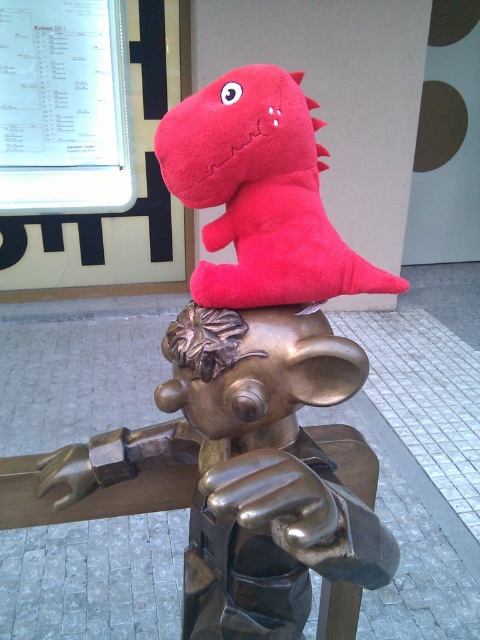
Does bronze statue at center have a larger size compared to metallic gold head at center?

Correct, bronze statue at center is larger in size than metallic gold head at center.

Looking at this image, can you confirm if bronze statue at center is thinner than metallic gold head at center?

No, bronze statue at center is not thinner than metallic gold head at center.

Describe the element at coordinates (251, 472) in the screenshot. I see `bronze statue at center` at that location.

Locate an element on the screen. bronze statue at center is located at coordinates (251, 472).

Does bronze statue at center appear over matte plush dinosaur at upper center?

No, bronze statue at center is not above matte plush dinosaur at upper center.

Which is in front, point (49, 481) or point (236, 122)?

Point (236, 122)

Locate an element on the screen. bronze statue at center is located at coordinates (251, 472).

Is matte plush dinosaur at upper center to the left of metallic gold head at center from the viewer's perspective?

Incorrect, matte plush dinosaur at upper center is not on the left side of metallic gold head at center.

Does matte plush dinosaur at upper center have a greater height compared to metallic gold head at center?

Correct, matte plush dinosaur at upper center is much taller as metallic gold head at center.

What do you see at coordinates (260, 193) in the screenshot?
I see `matte plush dinosaur at upper center` at bounding box center [260, 193].

I want to click on matte plush dinosaur at upper center, so click(x=260, y=193).